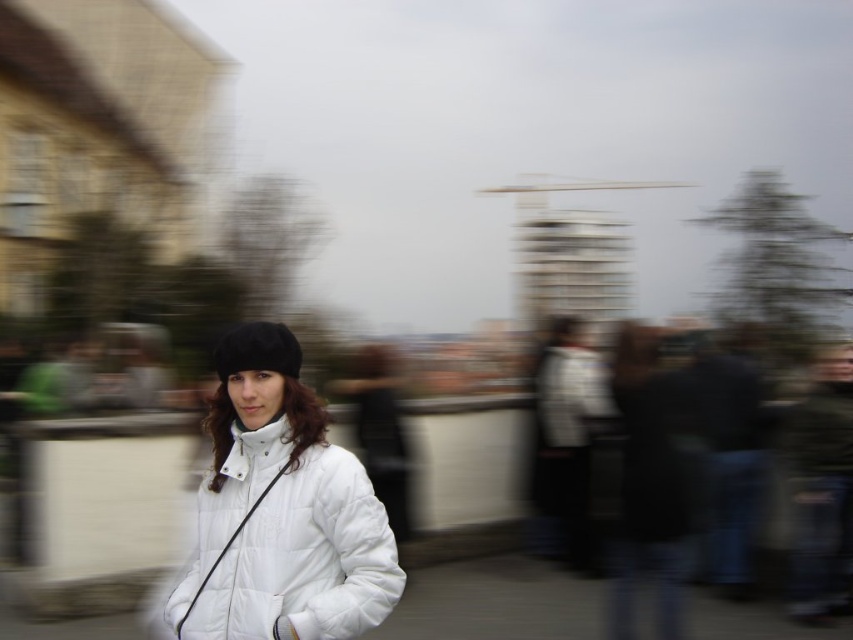
Between white puffy jacket at center and white fabric jacket at lower center, which one has more height?

white puffy jacket at center is taller.

Does point (262, 518) come farther from viewer compared to point (451, 586)?

No, it is not.

Describe the element at coordinates (283, 545) in the screenshot. I see `white puffy jacket at center` at that location.

You are a GUI agent. You are given a task and a screenshot of the screen. Output one action in this format:
    pyautogui.click(x=<x>, y=<y>)
    Task: Click on the white puffy jacket at center
    This screenshot has width=853, height=640.
    Given the screenshot: What is the action you would take?
    pyautogui.click(x=283, y=545)

The width and height of the screenshot is (853, 640). What do you see at coordinates (495, 604) in the screenshot?
I see `white fabric jacket at lower center` at bounding box center [495, 604].

Which of these two, white fabric jacket at lower center or black fuzzy hat at center, stands taller?

Standing taller between the two is black fuzzy hat at center.

Is point (585, 625) farther from viewer compared to point (213, 365)?

No, (585, 625) is in front of (213, 365).

The image size is (853, 640). I want to click on white fabric jacket at lower center, so click(x=495, y=604).

Does white puffy jacket at center have a larger size compared to black fuzzy hat at center?

Yes.

Measure the distance from white puffy jacket at center to black fuzzy hat at center.

white puffy jacket at center is 1.32 meters from black fuzzy hat at center.

This screenshot has width=853, height=640. I want to click on white puffy jacket at center, so click(283, 545).